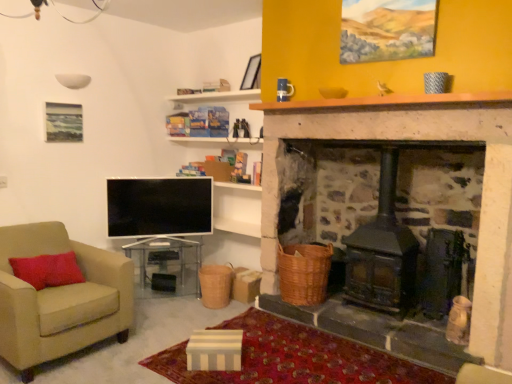
Find the location of a particular element. vacant location below flat screen tv at lower left (from a real-world perspective) is located at coordinates (158, 238).